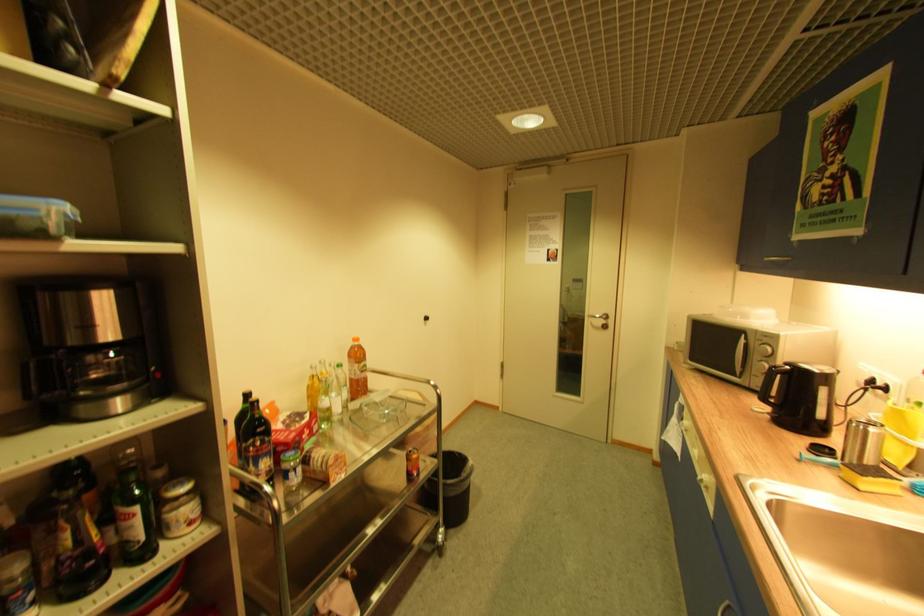
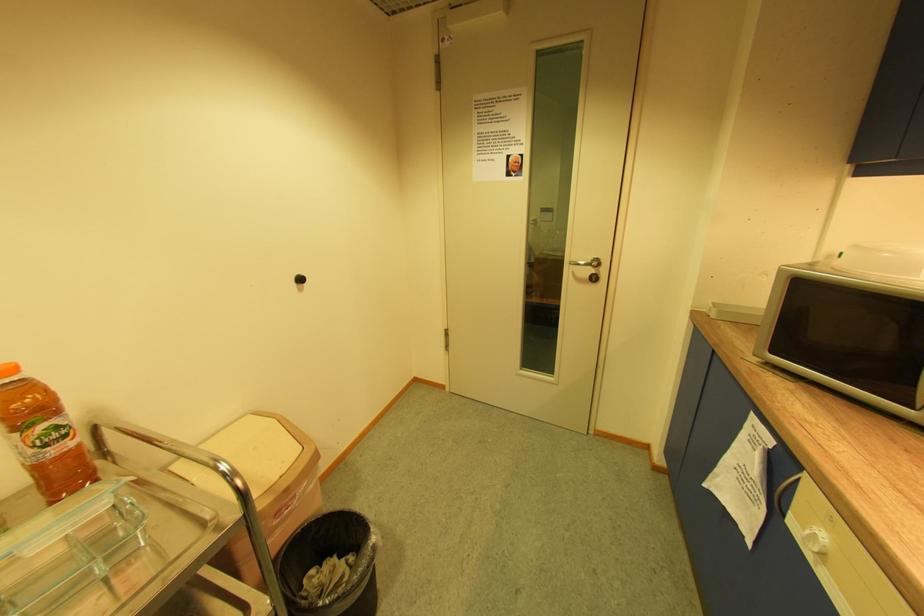
Locate, in the second image, the point that corresponds to [690,424] in the first image.

(825, 540)